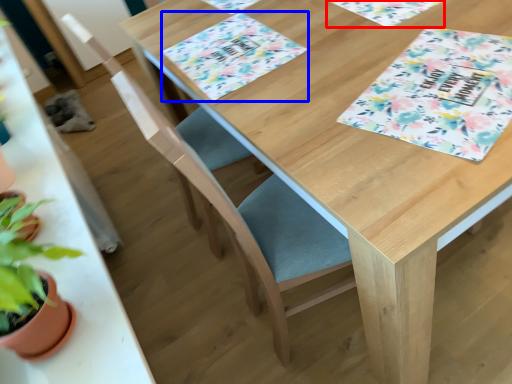
Question: Which of the following is the closest to the observer, place mat (highlighted by a red box) or place mat (highlighted by a blue box)?

Choices:
 (A) place mat
 (B) place mat

Answer: (B)